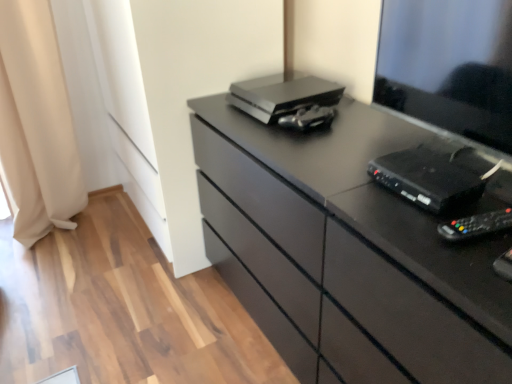
This screenshot has width=512, height=384. I want to click on vacant space that is in between metallic silver game controller at center, which is the 3th equipment in front-to-back order, and black plastic device at right, which is counted as the second equipment, starting from the back, so click(x=348, y=146).